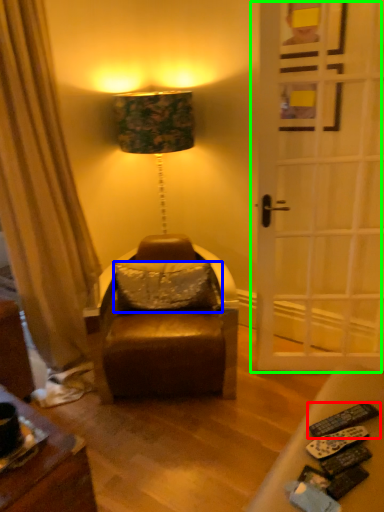
Question: Considering the real-world distances, which object is closest to remote control (highlighted by a red box)? pillow (highlighted by a blue box) or door (highlighted by a green box).

Choices:
 (A) pillow
 (B) door

Answer: (A)